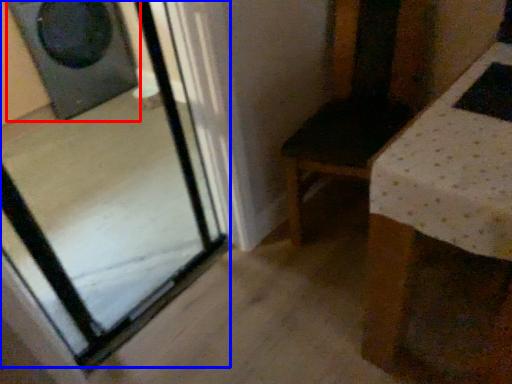
Question: Among these objects, which one is nearest to the camera, speaker (highlighted by a red box) or glass door (highlighted by a blue box)?

Choices:
 (A) speaker
 (B) glass door

Answer: (B)